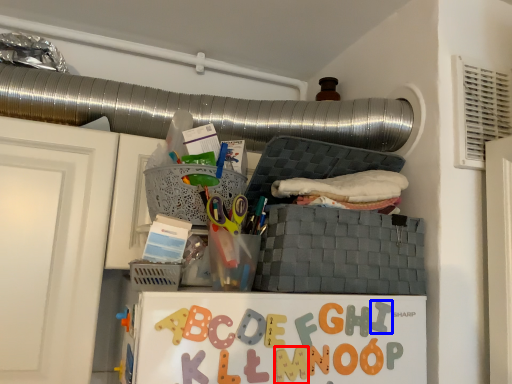
Question: Which object is further to the camera taking this photo, alphabet (highlighted by a red box) or alphabet (highlighted by a blue box)?

Choices:
 (A) alphabet
 (B) alphabet

Answer: (B)